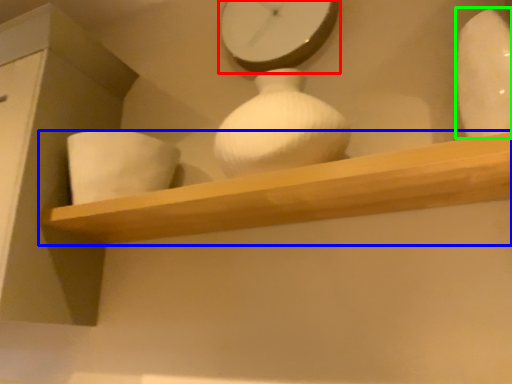
Question: Which object is positioned farthest from clock (highlighted by a red box)? Select from shelf (highlighted by a blue box) and vase (highlighted by a green box).

Choices:
 (A) shelf
 (B) vase

Answer: (A)